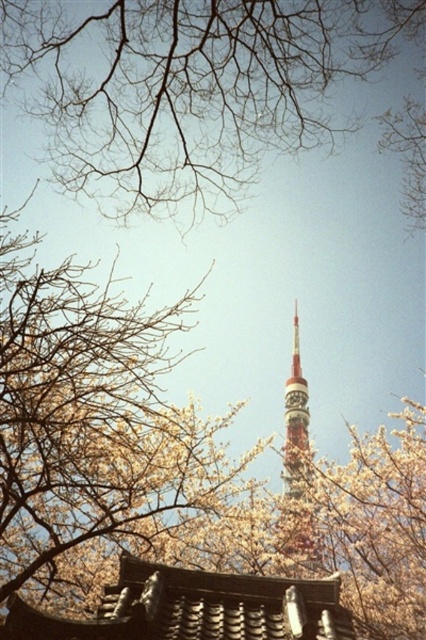
You are a photographer aiming to capture the Tokyo Tower against the cherry blossoms. Given that the bare branches at upper center are positioned at coordinates point 0.138, 0.448, how might their placement affect the composition of your photo?

The bare branches at upper center positioned at coordinates point [190,88] are centrally located in the upper part of the image, which could frame the Tokyo Tower effectively while adding a contrast between the stark branches and the tower.

You are standing in a park with the Tokyo Tower in the background and two points marked on the ground. The points are labeled as point (161, 161) and point (290, 465). If you want to walk towards the Tokyo Tower, which point should you step on first to stay on the path leading directly to the tower?

Point (161, 161) should be stepped on first because it is in front of point (290, 465), meaning it is closer to the Tokyo Tower and thus part of the direct path leading towards it.

You are a photographer standing in front of the Tokyo Tower scene. You want to take a photo where the bare branches at upper center and the shiny metallic tower at center are both in focus. Which object should you focus on first to ensure both are sharp?

You should focus on the bare branches at upper center first because it is closer to the viewer than the shiny metallic tower at center, so focusing on the closer object will help both be in focus.